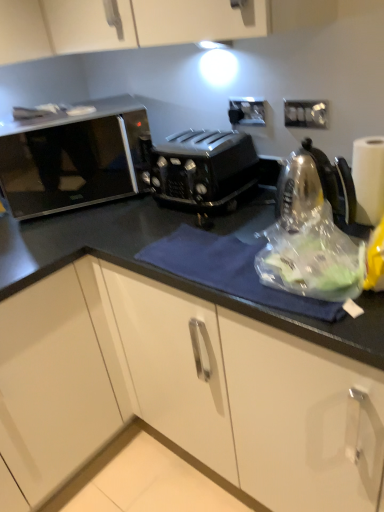
What is the approximate height of white plastic electric outlet at upper right, marked as the first electric outlet in a right-to-left arrangement?

The height of white plastic electric outlet at upper right, marked as the first electric outlet in a right-to-left arrangement, is 3.31 inches.

This screenshot has width=384, height=512. What do you see at coordinates (306, 114) in the screenshot?
I see `white plastic electric outlet at upper right, which is the first electric outlet in front-to-back order` at bounding box center [306, 114].

This screenshot has height=512, width=384. What are the coordinates of `sleek black microwave at left` in the screenshot? It's located at point(74,157).

You are a GUI agent. You are given a task and a screenshot of the screen. Output one action in this format:
    pyautogui.click(x=<x>, y=<y>)
    Task: Click on the white paper at right
    
    Given the screenshot: What is the action you would take?
    pyautogui.click(x=368, y=179)

Where is `white plastic electric outlet at upper right, marked as the first electric outlet in a right-to-left arrangement`? white plastic electric outlet at upper right, marked as the first electric outlet in a right-to-left arrangement is located at coordinates (306, 114).

Which object is closer to the camera, white paper at right or white plastic electric outlet at upper right, which is the first electric outlet in front-to-back order?

white paper at right is closer to the camera.

How different are the orientations of white paper at right and white plastic electric outlet at upper right, the 2th electric outlet when ordered from back to front, in degrees?

5.92 degrees.

Considering the sizes of objects white paper at right and white plastic electric outlet at upper right, which is the first electric outlet in front-to-back order, in the image provided, who is shorter, white paper at right or white plastic electric outlet at upper right, which is the first electric outlet in front-to-back order,?

Standing shorter between the two is white plastic electric outlet at upper right, which is the first electric outlet in front-to-back order.

From a real-world perspective, is white paper at right beneath white plastic electric outlet at upper right, the 2th electric outlet when ordered from back to front?

Yes, from a real-world perspective, white paper at right is below white plastic electric outlet at upper right, the 2th electric outlet when ordered from back to front.

Which is less distant, (x=249, y=110) or (x=167, y=162)?

The point (x=167, y=162) is more forward.

Does black plastic electric outlet at upper center, marked as the second electric outlet in a right-to-left arrangement, have a lesser height compared to black plastic toaster at center?

Yes.

Is black plastic electric outlet at upper center, marked as the second electric outlet in a right-to-left arrangement, surrounding black plastic toaster at center?

That's incorrect, black plastic toaster at center is not inside black plastic electric outlet at upper center, marked as the second electric outlet in a right-to-left arrangement.

Is black plastic electric outlet at upper center, acting as the first electric outlet starting from the left, to the left or to the right of black plastic toaster at center in the image?

Clearly, black plastic electric outlet at upper center, acting as the first electric outlet starting from the left, is on the right of black plastic toaster at center in the image.

Considering the positions of point (321, 125) and point (239, 113), is point (321, 125) closer or farther from the camera than point (239, 113)?

Point (321, 125).

Is white plastic electric outlet at upper right, marked as the first electric outlet in a right-to-left arrangement, thinner than black plastic electric outlet at upper center, marked as the second electric outlet in a right-to-left arrangement?

Correct, the width of white plastic electric outlet at upper right, marked as the first electric outlet in a right-to-left arrangement, is less than that of black plastic electric outlet at upper center, marked as the second electric outlet in a right-to-left arrangement.

Is white plastic electric outlet at upper right, the second electric outlet viewed from the left, next to black plastic electric outlet at upper center, marked as the second electric outlet in a right-to-left arrangement, and touching it?

No, white plastic electric outlet at upper right, the second electric outlet viewed from the left, is not beside black plastic electric outlet at upper center, marked as the second electric outlet in a right-to-left arrangement.

Does black plastic electric outlet at upper center, the 1th electric outlet positioned from the back, have a greater height compared to white paper at right?

In fact, black plastic electric outlet at upper center, the 1th electric outlet positioned from the back, may be shorter than white paper at right.

Is white paper at right completely or partially inside black plastic electric outlet at upper center, acting as the first electric outlet starting from the left?

No.

From the picture: From a real-world perspective, is black plastic electric outlet at upper center, acting as the first electric outlet starting from the left, above or below white paper at right?

black plastic electric outlet at upper center, acting as the first electric outlet starting from the left, is above white paper at right.

Can you confirm if black plastic electric outlet at upper center, which is the second electric outlet from front to back, is thinner than white paper at right?

Yes, black plastic electric outlet at upper center, which is the second electric outlet from front to back, is thinner than white paper at right.

Is white paper at right aimed at black plastic electric outlet at upper center, marked as the second electric outlet in a right-to-left arrangement?

No, white paper at right is not aimed at black plastic electric outlet at upper center, marked as the second electric outlet in a right-to-left arrangement.

Is white paper at right wider than black plastic electric outlet at upper center, acting as the first electric outlet starting from the left?

Yes.

Which of these two, white paper at right or black plastic electric outlet at upper center, marked as the second electric outlet in a right-to-left arrangement, is bigger?

white paper at right is bigger.

From the image's perspective, is white paper at right located beneath black plastic electric outlet at upper center, acting as the first electric outlet starting from the left?

Yes, from the image's perspective, white paper at right is beneath black plastic electric outlet at upper center, acting as the first electric outlet starting from the left.

Is sleek black microwave at left situated inside black plastic electric outlet at upper center, which is the second electric outlet from front to back, or outside?

sleek black microwave at left lies outside black plastic electric outlet at upper center, which is the second electric outlet from front to back.

Is sleek black microwave at left positioned before black plastic electric outlet at upper center, marked as the second electric outlet in a right-to-left arrangement?

Yes, sleek black microwave at left is in front of black plastic electric outlet at upper center, marked as the second electric outlet in a right-to-left arrangement.

Considering the positions of points (129, 174) and (254, 125), is point (129, 174) closer to camera compared to point (254, 125)?

No, it is behind (254, 125).

Would you consider sleek black microwave at left to be distant from black plastic electric outlet at upper center, acting as the first electric outlet starting from the left?

That's right, there is a large distance between sleek black microwave at left and black plastic electric outlet at upper center, acting as the first electric outlet starting from the left.

At what (x,y) coordinates should I click in order to perform the action: click on toaster lying above the white paper at right (from the image's perspective). Please return your answer as a coordinate pair (x, y). This screenshot has width=384, height=512. Looking at the image, I should click on (203, 169).

Between black plastic toaster at center and white paper at right, which one has larger size?

black plastic toaster at center is bigger.

Is white paper at right surrounded by black plastic toaster at center?

That's incorrect, white paper at right is not inside black plastic toaster at center.

Is black plastic toaster at center to the left of white paper at right from the viewer's perspective?

Indeed, black plastic toaster at center is positioned on the left side of white paper at right.

The width and height of the screenshot is (384, 512). I want to click on paper towel on the right of the white plastic electric outlet at upper right, the 2th electric outlet when ordered from back to front, so click(x=368, y=179).

At what (x,y) coordinates should I click in order to perform the action: click on toaster that appears below the black plastic electric outlet at upper center, which is the second electric outlet from front to back (from a real-world perspective). Please return your answer as a coordinate pair (x, y). This screenshot has width=384, height=512. Looking at the image, I should click on (203, 169).

From the image, which object appears to be nearer to white paper at right, white plastic electric outlet at upper right, which is the first electric outlet in front-to-back order, or black plastic electric outlet at upper center, acting as the first electric outlet starting from the left?

Based on the image, white plastic electric outlet at upper right, which is the first electric outlet in front-to-back order, appears to be nearer to white paper at right.

In the scene shown: Looking at the image, which one is located closer to black plastic toaster at center, white paper at right or sleek black microwave at left?

white paper at right is positioned closer to the anchor black plastic toaster at center.

When comparing their distances from white paper at right, does white plastic electric outlet at upper right, marked as the first electric outlet in a right-to-left arrangement, or sleek black microwave at left seem closer?

white plastic electric outlet at upper right, marked as the first electric outlet in a right-to-left arrangement, is positioned closer to the anchor white paper at right.

Looking at the image, which one is located further to black plastic electric outlet at upper center, acting as the first electric outlet starting from the left, white plastic electric outlet at upper right, which is the first electric outlet in front-to-back order, or sleek black microwave at left?

The object further to black plastic electric outlet at upper center, acting as the first electric outlet starting from the left, is sleek black microwave at left.

From the image, which object appears to be farther from black plastic electric outlet at upper center, the 1th electric outlet positioned from the back, white plastic electric outlet at upper right, marked as the first electric outlet in a right-to-left arrangement, or white paper at right?

Among the two, white paper at right is located further to black plastic electric outlet at upper center, the 1th electric outlet positioned from the back.

Based on the photo, from the image, which object appears to be farther from black plastic toaster at center, sleek black microwave at left or white plastic electric outlet at upper right, the 2th electric outlet when ordered from back to front?

Among the two, sleek black microwave at left is located further to black plastic toaster at center.

When comparing their distances from black plastic toaster at center, does black plastic electric outlet at upper center, which is the second electric outlet from front to back, or white paper at right seem further?

The object further to black plastic toaster at center is white paper at right.

Consider the image. When comparing their distances from white plastic electric outlet at upper right, the 2th electric outlet when ordered from back to front, does black plastic electric outlet at upper center, marked as the second electric outlet in a right-to-left arrangement, or white paper at right seem closer?

Based on the image, black plastic electric outlet at upper center, marked as the second electric outlet in a right-to-left arrangement, appears to be nearer to white plastic electric outlet at upper right, the 2th electric outlet when ordered from back to front.

Identify the location of toaster between sleek black microwave at left and white plastic electric outlet at upper right, which is the first electric outlet in front-to-back order. (203, 169).

Locate an element on the screen. The width and height of the screenshot is (384, 512). electric outlet between black plastic toaster at center and white plastic electric outlet at upper right, the second electric outlet viewed from the left, from left to right is located at coordinates (247, 111).

The image size is (384, 512). What are the coordinates of `toaster between sleek black microwave at left and white paper at right` in the screenshot? It's located at (203, 169).

This screenshot has width=384, height=512. I want to click on electric outlet between sleek black microwave at left and white plastic electric outlet at upper right, which is the first electric outlet in front-to-back order, in the horizontal direction, so click(247, 111).